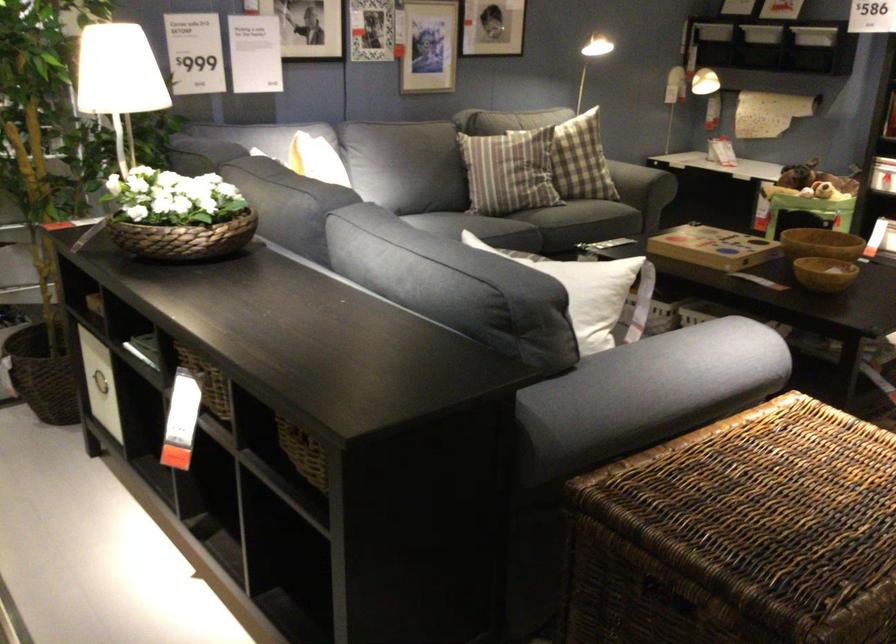
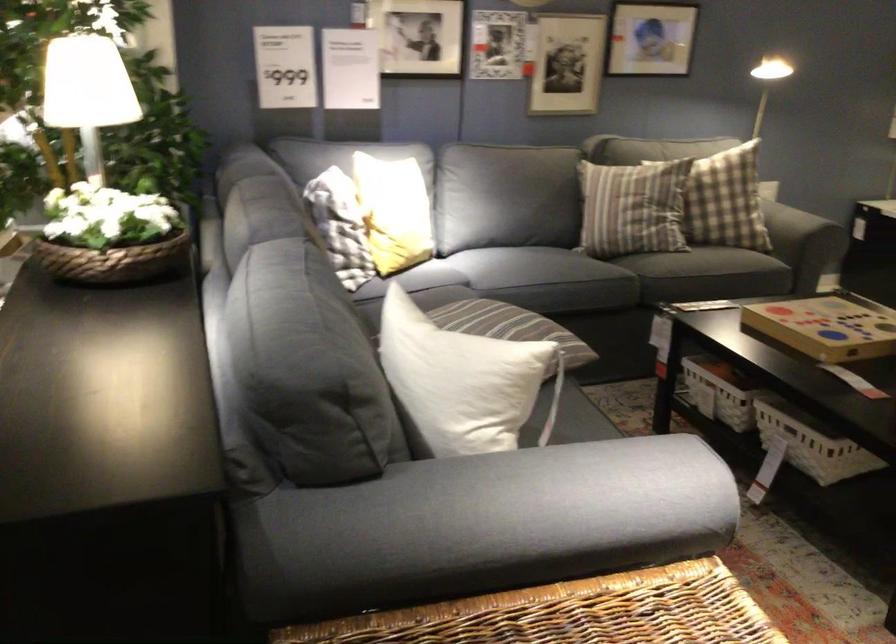
Question: How did the camera likely rotate?

Choices:
 (A) Left
 (B) Right
 (C) Up
 (D) Down

Answer: (A)